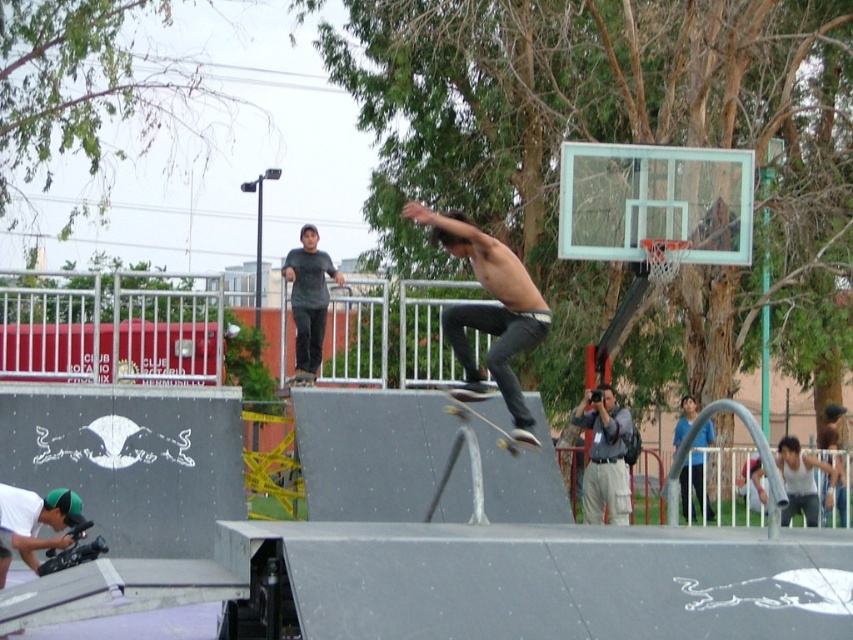
Question: Is shiny black skateboard at center to the right of wooden smooth skateboard at center from the viewer's perspective?

Choices:
 (A) yes
 (B) no

Answer: (B)

Question: In this image, where is gray fabric camera at center located relative to dark gray shirt at upper center?

Choices:
 (A) right
 (B) left

Answer: (A)

Question: Estimate the real-world distances between objects in this image. Which object is farther from the shiny black skateboard at center?

Choices:
 (A) wooden smooth skateboard at center
 (B) dark gray shirt at upper center

Answer: (B)

Question: Which of the following is the farthest from the observer?

Choices:
 (A) gray fabric camera at center
 (B) wooden smooth skateboard at center

Answer: (A)

Question: Estimate the real-world distances between objects in this image. Which object is closer to the dark gray shirt at upper center?

Choices:
 (A) gray fabric camera at center
 (B) shiny black skateboard at center
 (C) wooden smooth skateboard at center

Answer: (C)

Question: Is dark gray shirt at upper center positioned before wooden smooth skateboard at center?

Choices:
 (A) yes
 (B) no

Answer: (B)